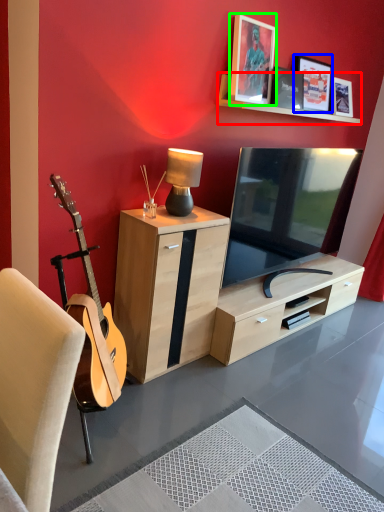
Question: Which object is positioned farthest from shelf (highlighted by a red box)? Select from picture frame (highlighted by a blue box) and picture frame (highlighted by a green box).

Choices:
 (A) picture frame
 (B) picture frame

Answer: (A)